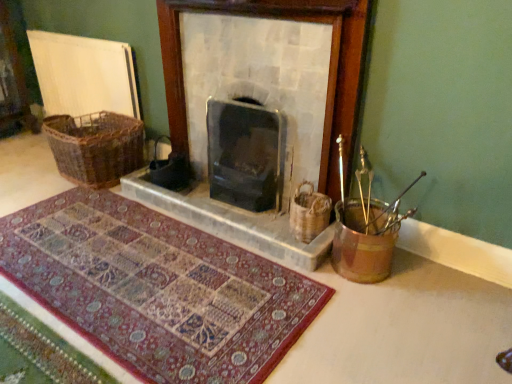
Identify the location of space that is in front of metallic gold bucket at right. (368, 307).